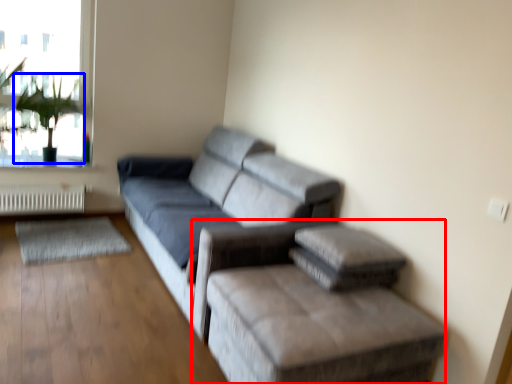
Question: Which of the following is the farthest to the observer, furniture (highlighted by a red box) or plant (highlighted by a blue box)?

Choices:
 (A) furniture
 (B) plant

Answer: (B)